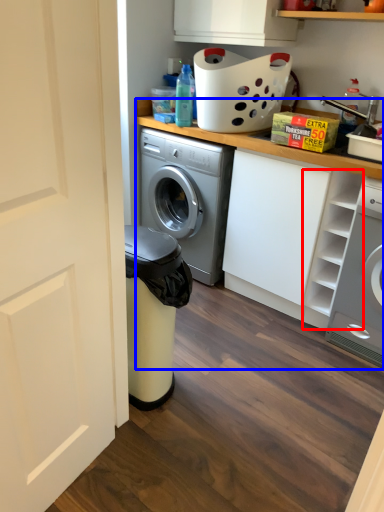
Question: Which point is closer to the camera, shelf (highlighted by a red box) or counter top (highlighted by a blue box)?

Choices:
 (A) shelf
 (B) counter top

Answer: (A)